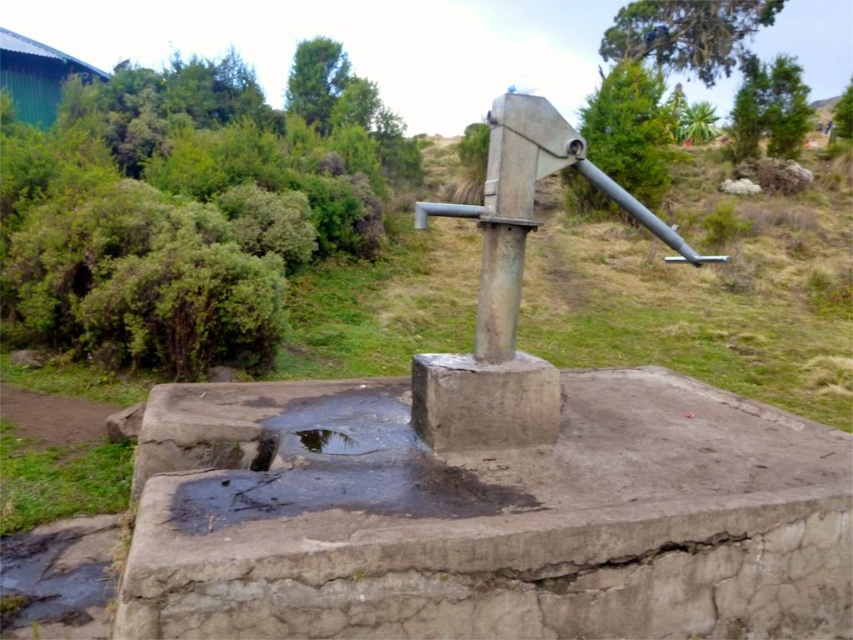
Does gray concrete basin at center have a greater height compared to black glossy puddle at center?

Yes.

Measure the distance between gray concrete basin at center and camera.

gray concrete basin at center is 1.94 meters from camera.

In the scene shown: Who is more distant from viewer, (167, 554) or (340, 444)?

Point (340, 444)

Find the location of a particular element. gray concrete basin at center is located at coordinates (486, 509).